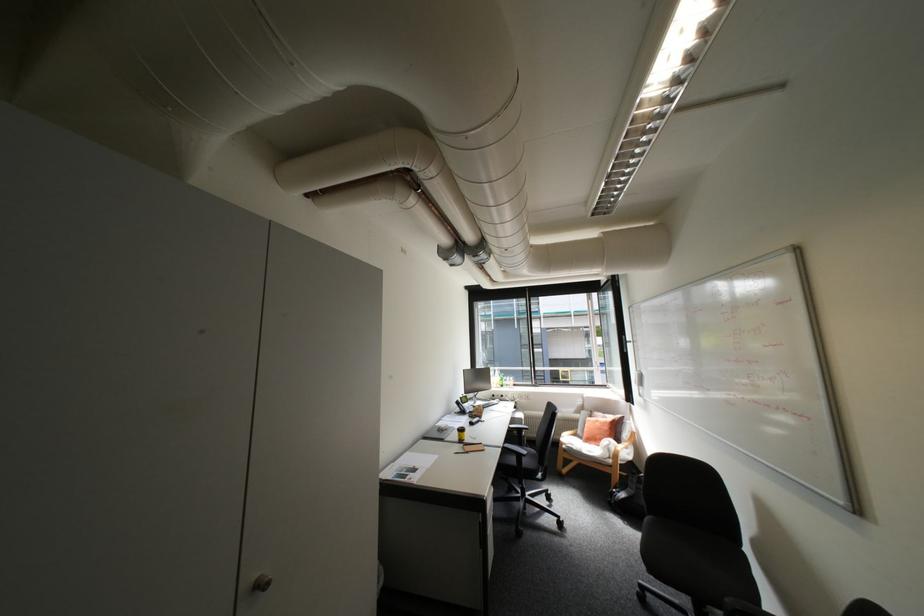
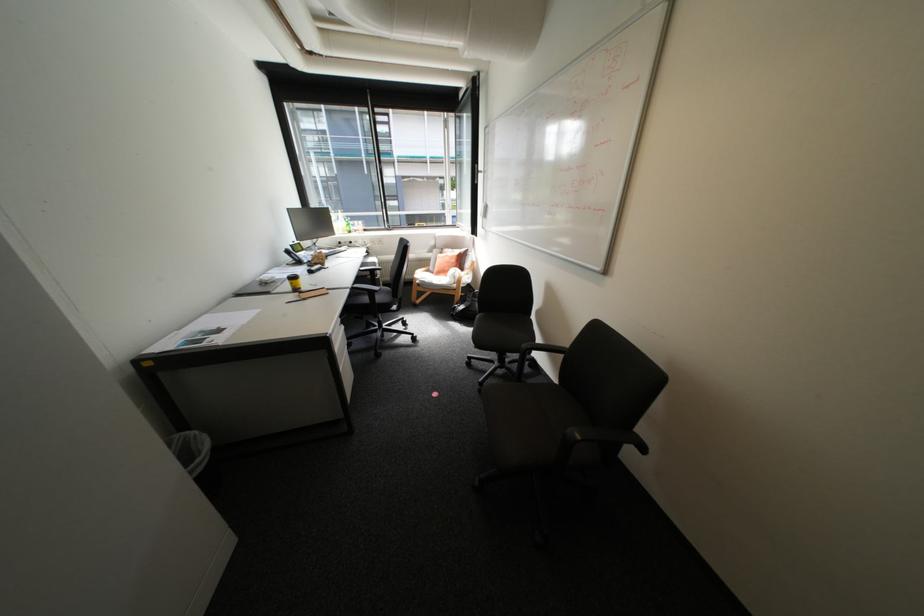
Where in the second image is the point corresponding to (512,446) from the first image?

(359, 286)